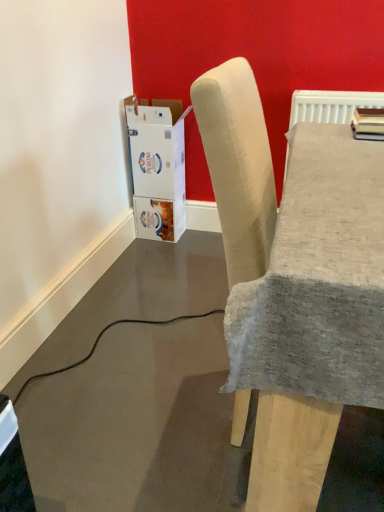
This screenshot has height=512, width=384. What do you see at coordinates (238, 166) in the screenshot? I see `beige fabric chair at center` at bounding box center [238, 166].

The image size is (384, 512). I want to click on beige fabric chair at center, so click(x=238, y=166).

From the picture: Measure the distance between white cardboard box at lower left and camera.

white cardboard box at lower left is 1.96 meters from camera.

In order to face white cardboard box at lower left, should I rotate leftwards or rightwards?

You should rotate left by 4.085 degrees.

Where is `white cardboard box at lower left`? white cardboard box at lower left is located at coordinates (157, 170).

What do you see at coordinates (157, 170) in the screenshot? I see `white cardboard box at lower left` at bounding box center [157, 170].

Measure the distance between point [164,118] and camera.

The depth of point [164,118] is 1.96 meters.

What is the approximate width of white cardboard box at lower left?

13.44 inches.

Where is `beige fabric chair at center`? The height and width of the screenshot is (512, 384). beige fabric chair at center is located at coordinates (238, 166).

Does white cardboard box at lower left appear on the right side of beige fabric chair at center?

No, white cardboard box at lower left is not to the right of beige fabric chair at center.

Does white cardboard box at lower left lie behind beige fabric chair at center?

Yes, the depth of white cardboard box at lower left is greater than that of beige fabric chair at center.

Is point (168, 136) positioned behind point (235, 161)?

Yes, it is behind point (235, 161).

In the scene shown: From the image's perspective, is white cardboard box at lower left positioned above or below beige fabric chair at center?

From the image's perspective, white cardboard box at lower left appears above beige fabric chair at center.

From a real-world perspective, is white cardboard box at lower left below beige fabric chair at center?

Yes.

Is white cardboard box at lower left wider or thinner than beige fabric chair at center?

Considering their sizes, white cardboard box at lower left looks slimmer than beige fabric chair at center.

From the picture: Who is taller, white cardboard box at lower left or beige fabric chair at center?

beige fabric chair at center.

Considering the relative sizes of white cardboard box at lower left and beige fabric chair at center in the image provided, is white cardboard box at lower left smaller than beige fabric chair at center?

Yes, white cardboard box at lower left is smaller than beige fabric chair at center.

Is white cardboard box at lower left not inside beige fabric chair at center?

Yes, white cardboard box at lower left is not within beige fabric chair at center.

Would you say white cardboard box at lower left is a long distance from beige fabric chair at center?

Yes.

Could you tell me if white cardboard box at lower left is facing beige fabric chair at center?

No, white cardboard box at lower left does not turn towards beige fabric chair at center.

At what (x,y) coordinates should I click in order to perform the action: click on chair located in front of the white cardboard box at lower left. Please return your answer as a coordinate pair (x, y). Looking at the image, I should click on (238, 166).

Is beige fabric chair at center to the right of white cardboard box at lower left from the viewer's perspective?

Correct, you'll find beige fabric chair at center to the right of white cardboard box at lower left.

Is the position of beige fabric chair at center less distant than that of white cardboard box at lower left?

Yes, beige fabric chair at center is closer to the camera.

Is point (212, 90) closer to viewer compared to point (168, 226)?

Yes.

From the image's perspective, is beige fabric chair at center beneath white cardboard box at lower left?

Correct, beige fabric chair at center appears lower than white cardboard box at lower left in the image.

From a real-world perspective, is beige fabric chair at center physically above white cardboard box at lower left?

Indeed, from a real-world perspective, beige fabric chair at center stands above white cardboard box at lower left.

Does beige fabric chair at center have a greater width compared to white cardboard box at lower left?

Yes.

Which of these two, beige fabric chair at center or white cardboard box at lower left, stands shorter?

white cardboard box at lower left.

Which of these two, beige fabric chair at center or white cardboard box at lower left, is bigger?

Bigger between the two is beige fabric chair at center.

In the scene shown: Is white cardboard box at lower left a part of beige fabric chair at center?

No, white cardboard box at lower left is not surrounded by beige fabric chair at center.

Is beige fabric chair at center next to white cardboard box at lower left?

No, beige fabric chair at center is not touching white cardboard box at lower left.

Is beige fabric chair at center turned away from white cardboard box at lower left?

No, white cardboard box at lower left is not at the back of beige fabric chair at center.

How many degrees apart are the facing directions of beige fabric chair at center and white cardboard box at lower left?

beige fabric chair at center and white cardboard box at lower left are facing 0.134 degrees away from each other.

Measure the distance between beige fabric chair at center and white cardboard box at lower left.

beige fabric chair at center and white cardboard box at lower left are 1.16 meters apart.

Image resolution: width=384 pixels, height=512 pixels. In order to click on cardboard box behind the beige fabric chair at center in this screenshot , I will do `click(157, 170)`.

Identify the location of cardboard box located underneath the beige fabric chair at center (from a real-world perspective). (157, 170).

The height and width of the screenshot is (512, 384). What are the coordinates of `chair located below the white cardboard box at lower left (from the image's perspective)` in the screenshot? It's located at (238, 166).